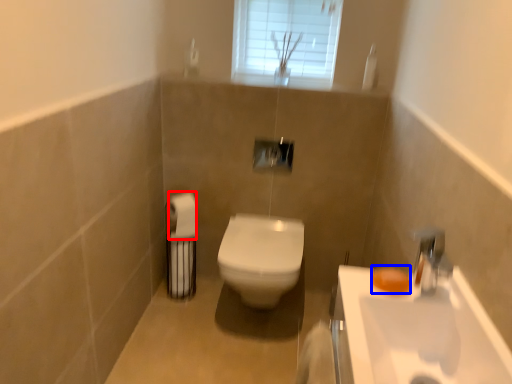
Question: Among these objects, which one is farthest to the camera, toilet paper (highlighted by a red box) or soap (highlighted by a blue box)?

Choices:
 (A) toilet paper
 (B) soap

Answer: (A)